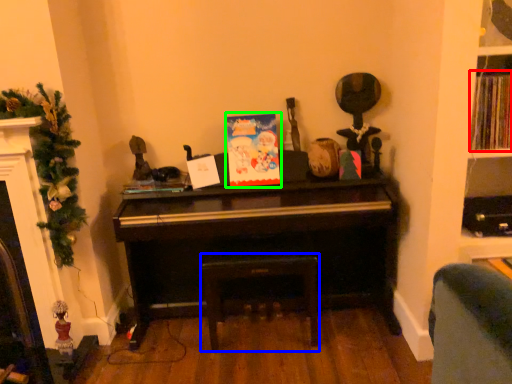
Question: Based on their relative distances, which object is farther from book (highlighted by a red box)? Choose from stool (highlighted by a blue box) and christmas card (highlighted by a green box).

Choices:
 (A) stool
 (B) christmas card

Answer: (A)